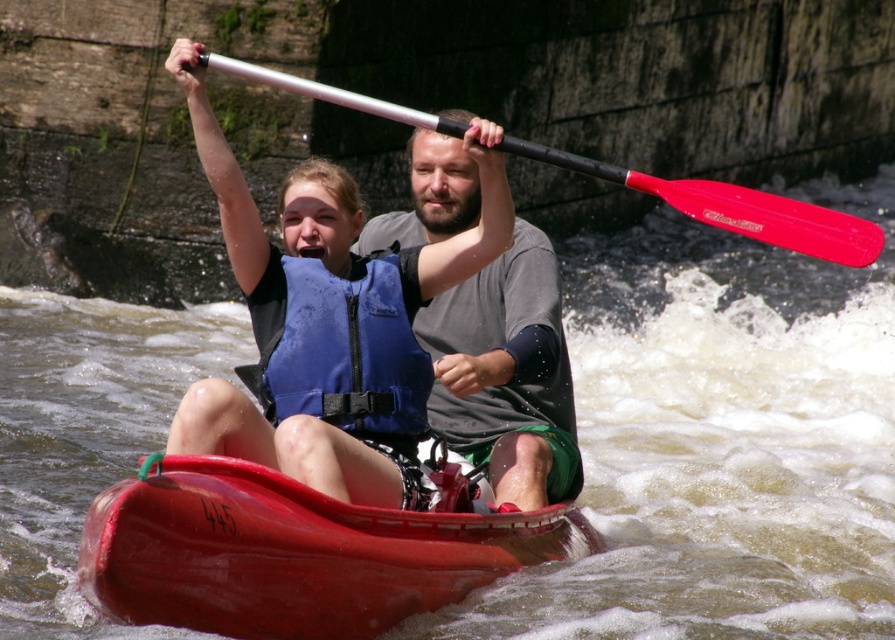
Question: Can you confirm if brown textured water at center is thinner than gray cotton shirt at center?

Choices:
 (A) no
 (B) yes

Answer: (A)

Question: Does gray cotton shirt at center have a smaller size compared to metallic paddle at upper center?

Choices:
 (A) yes
 (B) no

Answer: (A)

Question: Which of the following is the farthest from the observer?

Choices:
 (A) smooth plastic canoe at center
 (B) brown textured water at center

Answer: (B)

Question: Considering the real-world distances, which object is farthest from the gray cotton shirt at center?

Choices:
 (A) brown textured water at center
 (B) blue life vest at center

Answer: (A)

Question: Can you confirm if smooth plastic canoe at center is smaller than metallic paddle at upper center?

Choices:
 (A) no
 (B) yes

Answer: (B)

Question: Which object is closer to the camera taking this photo?

Choices:
 (A) smooth plastic canoe at center
 (B) metallic paddle at upper center

Answer: (A)